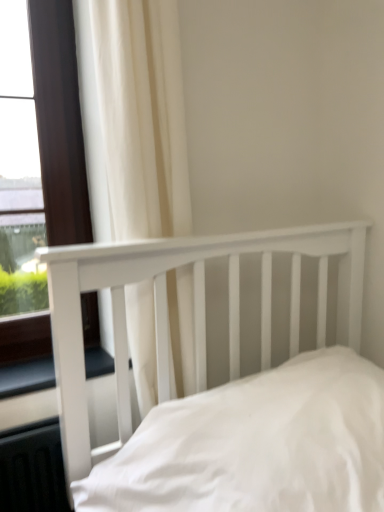
Question: Is white fabric curtain at upper left to the left of black rubber window sill at lower left from the viewer's perspective?

Choices:
 (A) yes
 (B) no

Answer: (B)

Question: Considering the relative positions of white fabric curtain at upper left and black rubber window sill at lower left in the image provided, is white fabric curtain at upper left to the right of black rubber window sill at lower left from the viewer's perspective?

Choices:
 (A) yes
 (B) no

Answer: (A)

Question: Would you say white fabric curtain at upper left is a long distance from black rubber window sill at lower left?

Choices:
 (A) yes
 (B) no

Answer: (B)

Question: Is white fabric curtain at upper left bigger than black rubber window sill at lower left?

Choices:
 (A) no
 (B) yes

Answer: (B)

Question: From a real-world perspective, is white fabric curtain at upper left on top of black rubber window sill at lower left?

Choices:
 (A) no
 (B) yes

Answer: (B)

Question: Does white fabric curtain at upper left have a smaller size compared to black rubber window sill at lower left?

Choices:
 (A) yes
 (B) no

Answer: (B)

Question: From the image's perspective, would you say black rubber window sill at lower left is shown under matte brown window at left?

Choices:
 (A) no
 (B) yes

Answer: (B)

Question: Could matte brown window at left be considered to be inside black rubber window sill at lower left?

Choices:
 (A) yes
 (B) no

Answer: (B)

Question: From the image's perspective, is black rubber window sill at lower left on matte brown window at left?

Choices:
 (A) no
 (B) yes

Answer: (A)

Question: Is matte brown window at left at the back of black rubber window sill at lower left?

Choices:
 (A) no
 (B) yes

Answer: (B)

Question: Is black rubber window sill at lower left facing towards matte brown window at left?

Choices:
 (A) yes
 (B) no

Answer: (B)

Question: Can you confirm if black rubber window sill at lower left is bigger than matte brown window at left?

Choices:
 (A) no
 (B) yes

Answer: (A)

Question: From the image's perspective, is matte brown window at left above black rubber window sill at lower left?

Choices:
 (A) no
 (B) yes

Answer: (B)